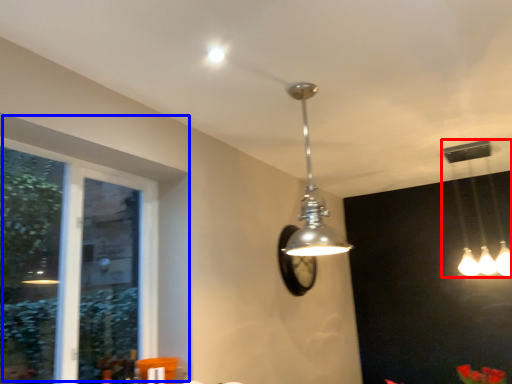
Question: Which of the following is the closest to the observer, lamp (highlighted by a red box) or window (highlighted by a blue box)?

Choices:
 (A) lamp
 (B) window

Answer: (B)